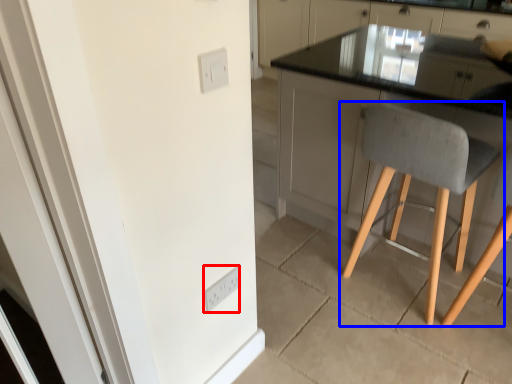
Question: Which object is further to the camera taking this photo, light switch (highlighted by a red box) or chair (highlighted by a blue box)?

Choices:
 (A) light switch
 (B) chair

Answer: (A)